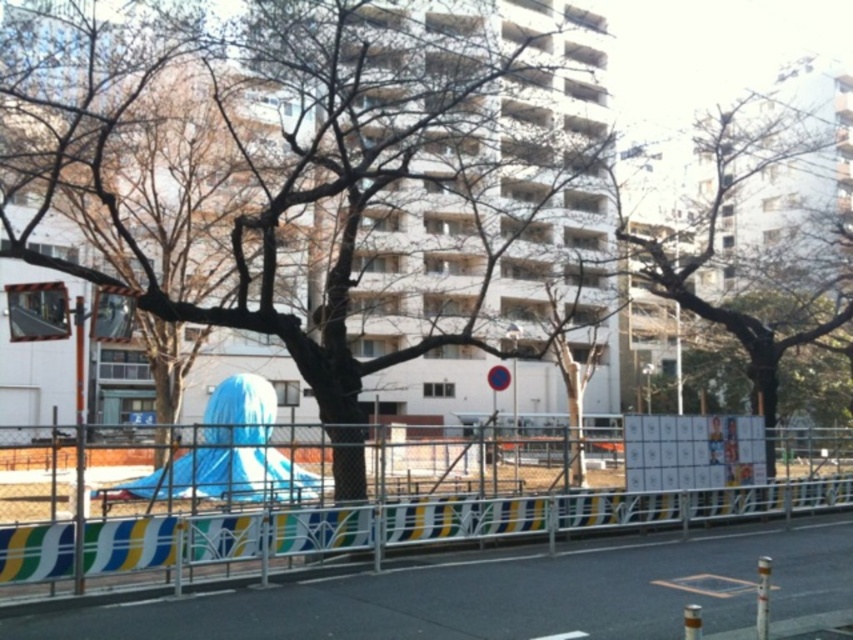
The width and height of the screenshot is (853, 640). I want to click on metallic silver fence at center, so click(x=416, y=516).

Measure the distance between metallic silver fence at center and camera.

metallic silver fence at center and camera are 9.20 meters apart.

Between point (753, 424) and point (642, 259), which one is positioned in front?

Point (753, 424)

Find the location of `metallic silver fence at center`. metallic silver fence at center is located at coordinates (416, 516).

Which is more to the left, brown rough bark tree at center or bare wood tree at center?

From the viewer's perspective, brown rough bark tree at center appears more on the left side.

Does point (489, 228) come closer to viewer compared to point (837, 316)?

Yes, it is.

At what (x,y) coordinates should I click in order to perform the action: click on brown rough bark tree at center. Please return your answer as a coordinate pair (x, y). Looking at the image, I should click on (328, 179).

Between brown rough bark tree at center and metallic silver fence at center, which one appears on the left side from the viewer's perspective?

metallic silver fence at center

In the scene shown: Who is lower down, brown rough bark tree at center or metallic silver fence at center?

metallic silver fence at center is below.

Which is behind, point (239, 259) or point (323, 550)?

The point (239, 259) is more distant.

Where is `brown rough bark tree at center`? Image resolution: width=853 pixels, height=640 pixels. brown rough bark tree at center is located at coordinates (328, 179).